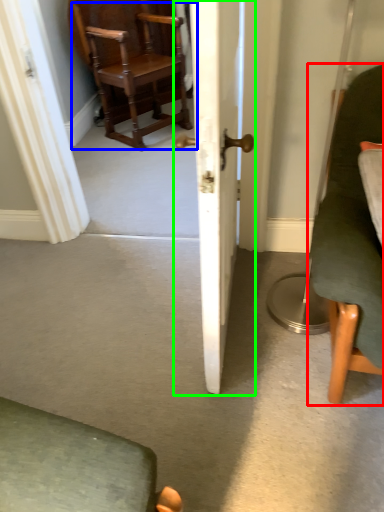
Question: Estimate the real-world distances between objects in this image. Which object is farther from chair (highlighted by a red box), chair (highlighted by a blue box) or door (highlighted by a green box)?

Choices:
 (A) chair
 (B) door

Answer: (A)